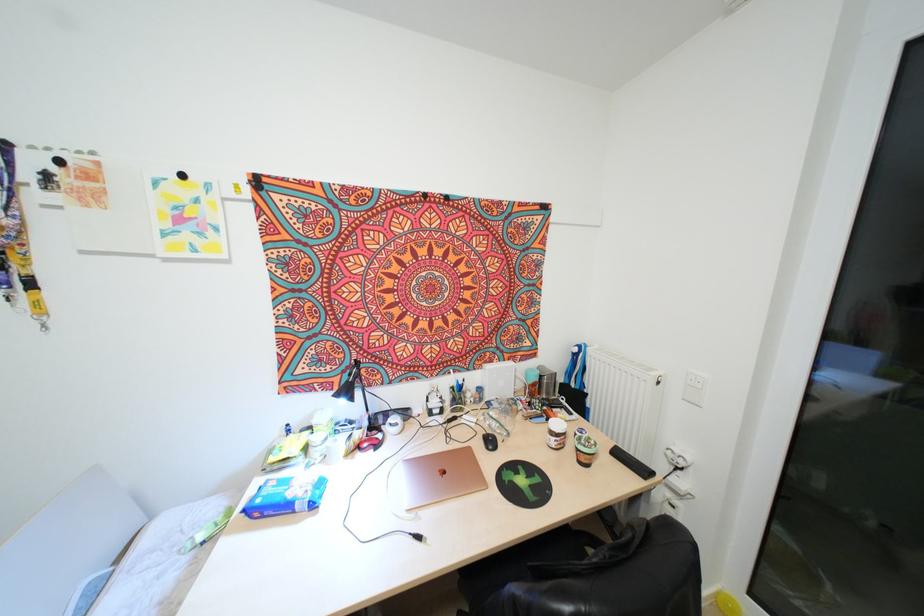
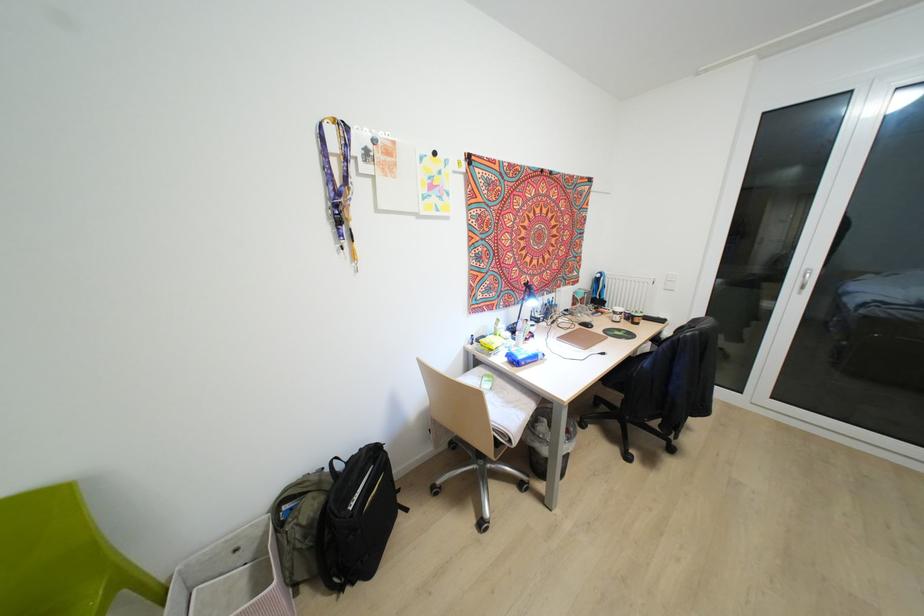
Locate, in the second image, the point that corresponds to point 494,448 in the first image.

(591, 326)